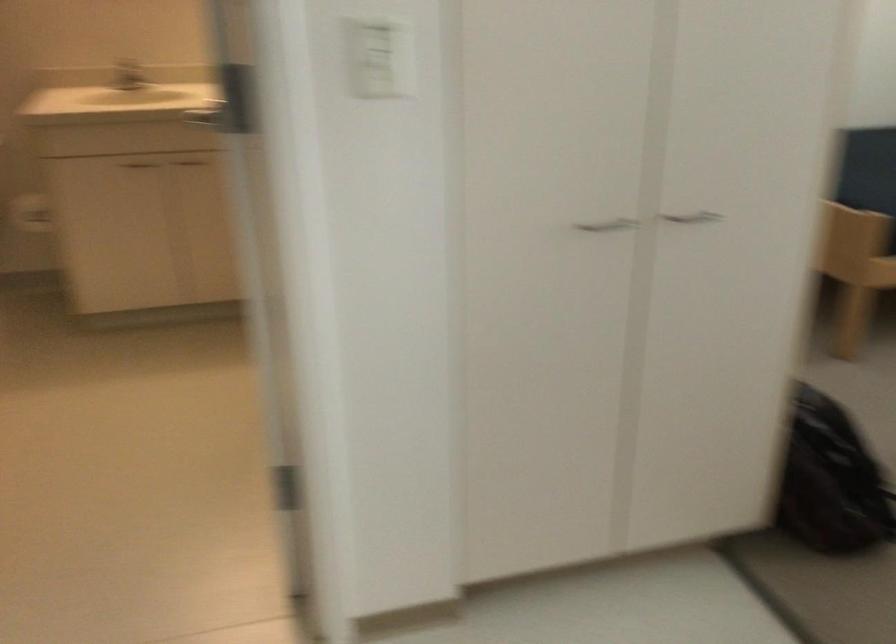
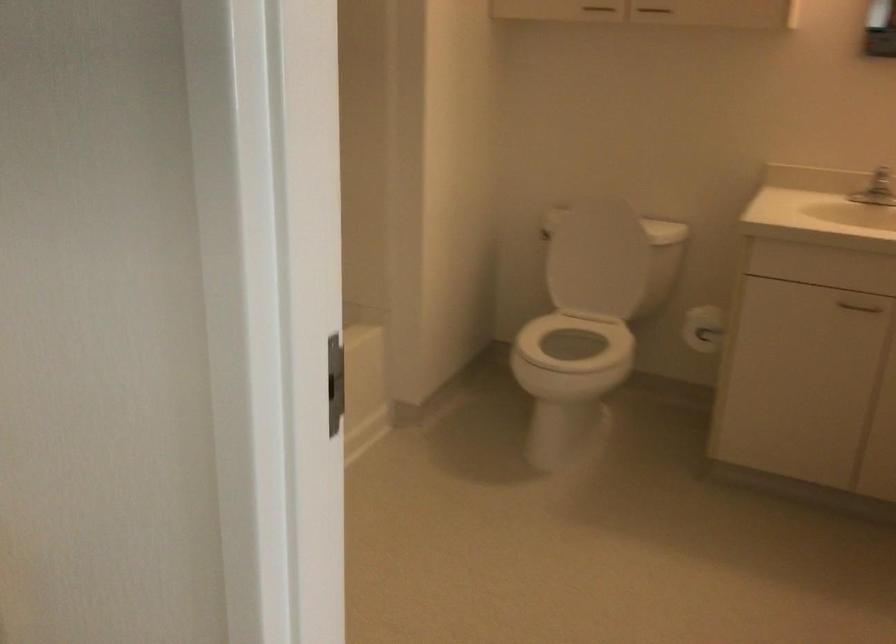
Question: The images are taken continuously from a first-person perspective. In which direction is your viewpoint rotating?

Choices:
 (A) Left
 (B) Right
 (C) Up
 (D) Down

Answer: (A)